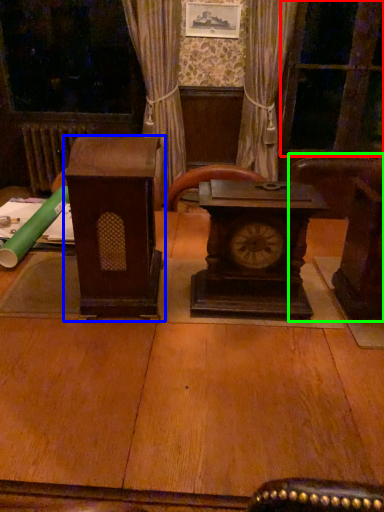
Question: Estimate the real-world distances between objects in this image. Which object is closer to glass door (highlighted by a red box), furniture (highlighted by a blue box) or furniture (highlighted by a green box)?

Choices:
 (A) furniture
 (B) furniture

Answer: (B)